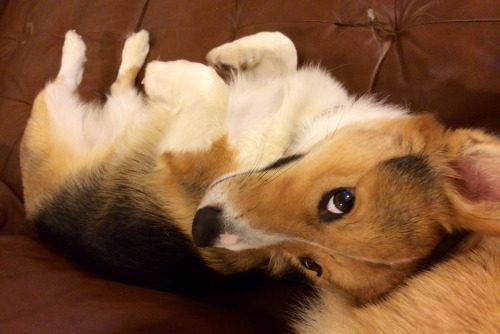
Find the location of `pillow`. pillow is located at coordinates (458, 295).